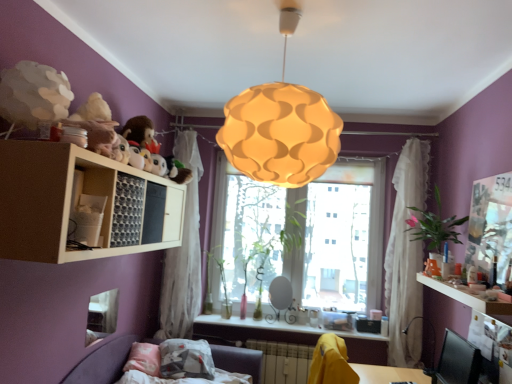
The image size is (512, 384). What are the coordinates of `free point above matte orange lampshade at center (from a real-world perspective)` in the screenshot? It's located at (279, 16).